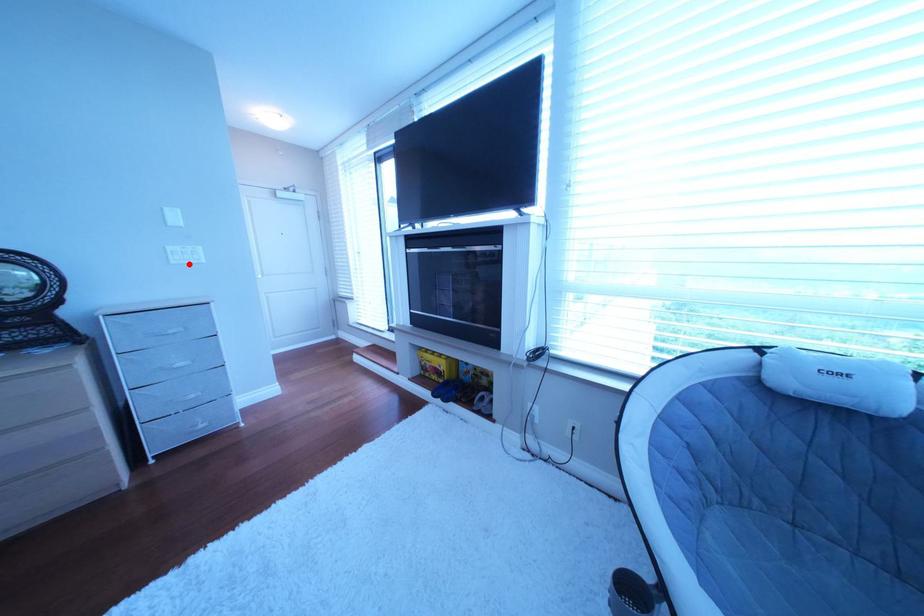
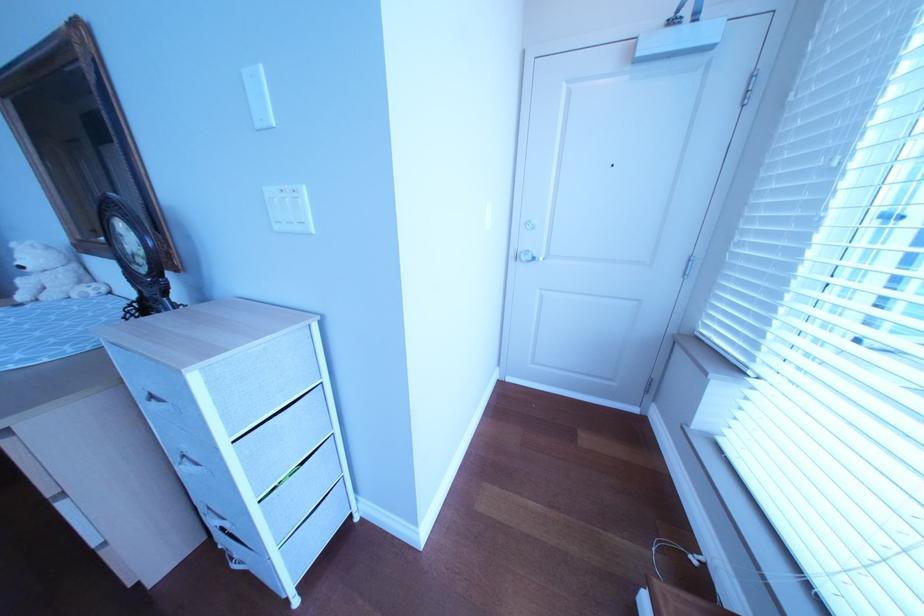
The point at the highlighted location is marked in the first image. Where is the corresponding point in the second image?

(292, 229)